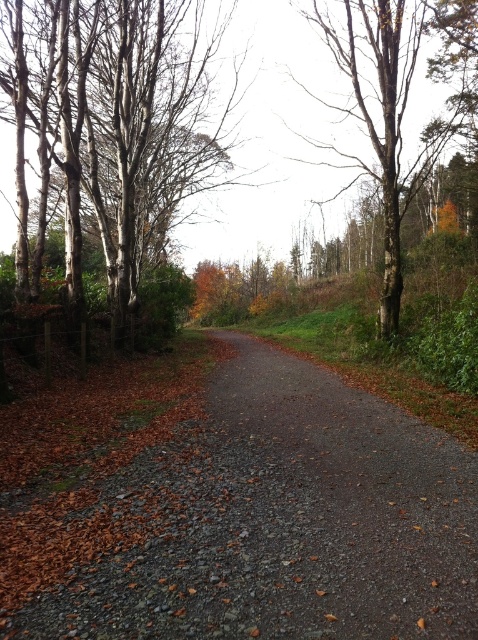
Question: Which object appears farthest from the camera in this image?

Choices:
 (A) bare bark tree at upper right
 (B) brown gravel trail at center
 (C) smooth white bark at left

Answer: (A)

Question: Which of the following is the closest to the observer?

Choices:
 (A) bare bark tree at upper right
 (B) brown gravel trail at center

Answer: (B)

Question: Can you confirm if smooth white bark at left is wider than bare bark tree at upper right?

Choices:
 (A) no
 (B) yes

Answer: (A)

Question: Does smooth white bark at left come in front of bare bark tree at upper right?

Choices:
 (A) no
 (B) yes

Answer: (B)

Question: Which object is positioned closest to the smooth white bark at left?

Choices:
 (A) brown gravel trail at center
 (B) bare bark tree at upper right

Answer: (B)

Question: Is brown gravel trail at center in front of bare bark tree at upper right?

Choices:
 (A) yes
 (B) no

Answer: (A)